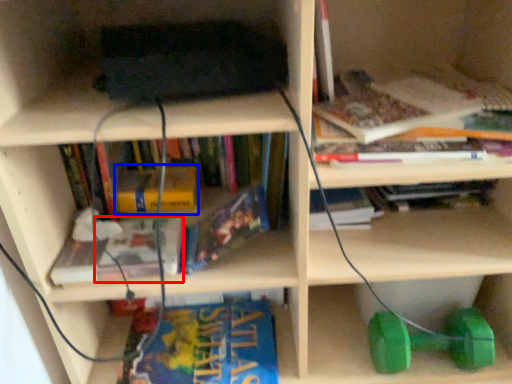
Question: Which object is further to the camera taking this photo, book (highlighted by a red box) or book (highlighted by a blue box)?

Choices:
 (A) book
 (B) book

Answer: (B)